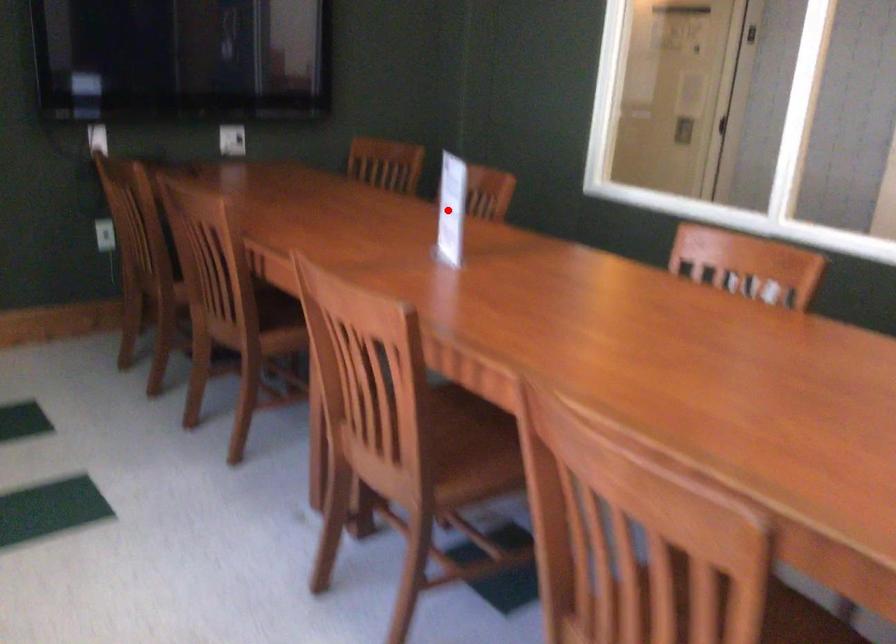
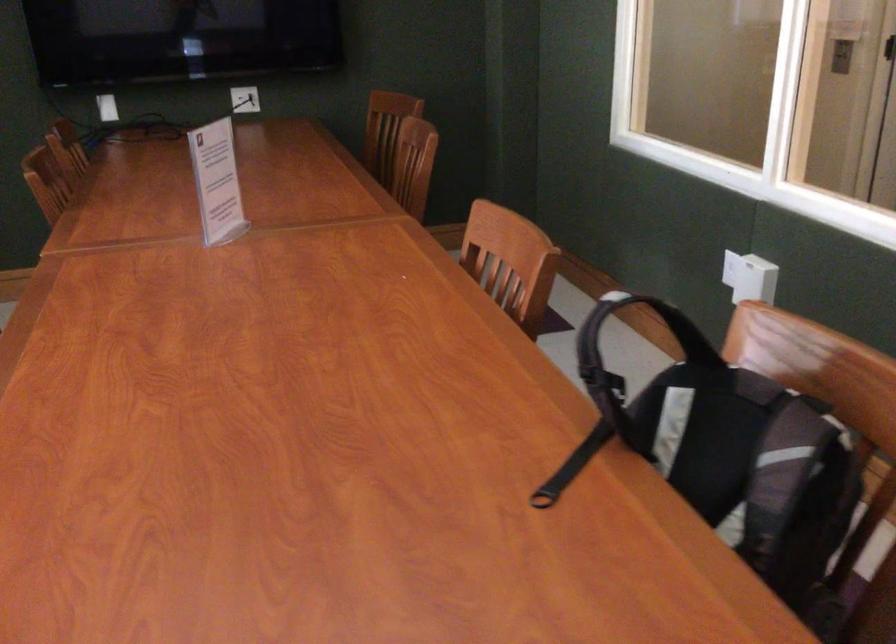
Question: A red point is marked in image1. In image2, is the corresponding 3D point closer to the camera or farther? Reply with the corresponding letter.

Choices:
 (A) The corresponding 3D point is closer.
 (B) The corresponding 3D point is farther.

Answer: (A)